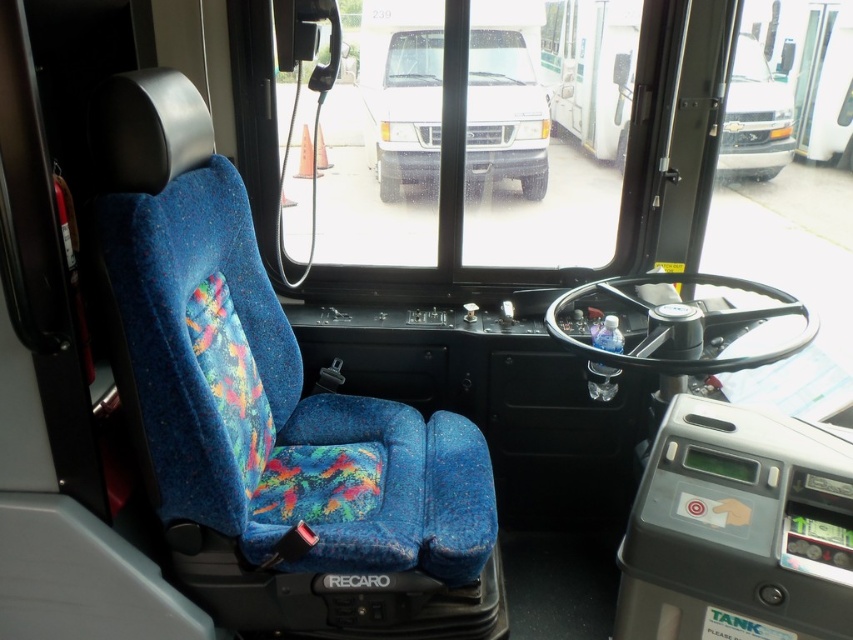
Which is more to the left, matte black van at center or matte black van at upper center?

matte black van at center

Does matte black van at center appear over matte black van at upper center?

Correct, matte black van at center is located above matte black van at upper center.

Who is more forward, (511, 86) or (730, 132)?

Point (730, 132)

This screenshot has width=853, height=640. In order to click on matte black van at center in this screenshot , I will do (401, 90).

Between transparent glass window at center and matte black van at upper center, which one has less height?

Standing shorter between the two is matte black van at upper center.

Between point (347, 243) and point (769, 93), which one is positioned in front?

Point (769, 93) is in front.

Where is `transparent glass window at center`? The height and width of the screenshot is (640, 853). transparent glass window at center is located at coordinates (541, 138).

Is transparent glass window at center above matte black van at center?

No, transparent glass window at center is not above matte black van at center.

Which of these two, transparent glass window at center or matte black van at center, stands taller?

transparent glass window at center

Who is more distant from viewer, (428, 173) or (392, 74)?

The point (428, 173) is behind.

Image resolution: width=853 pixels, height=640 pixels. In order to click on transparent glass window at center in this screenshot , I will do `click(541, 138)`.